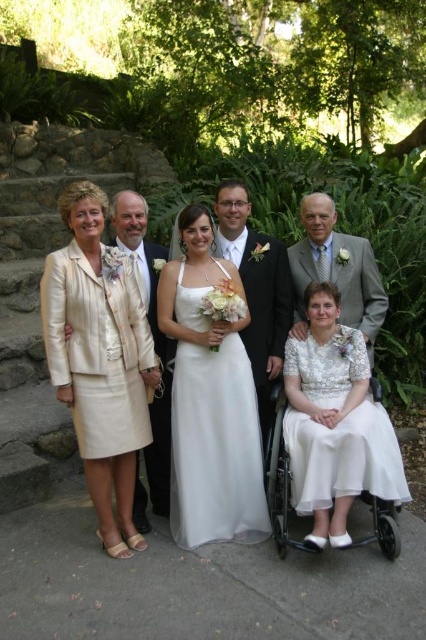
You are a photographer trying to frame the white lace dress at lower center and the light gray suit at right in a close shot. Which of the two should you zoom in on more to ensure both are equally visible?

Since the white lace dress at lower center is smaller than the light gray suit at right, you should zoom in more on the white lace dress at lower center to balance their sizes in the frame.

You are standing in front of the wedding photo and want to touch the two points marked in the image. Which point, point (371, 410) or point (161, 442), would you reach first if you move towards them from your current position?

Point (371, 410) is closer to the viewer than point (161, 442), so you would reach point (371, 410) first.

You are a photographer adjusting the lighting for the group photo. You notice the white lace dress at lower center and the light beige fabric suit at left. Which of these two outfits is positioned to the right side of the other?

The white lace dress at lower center is positioned on the right side of light beige fabric suit at left.